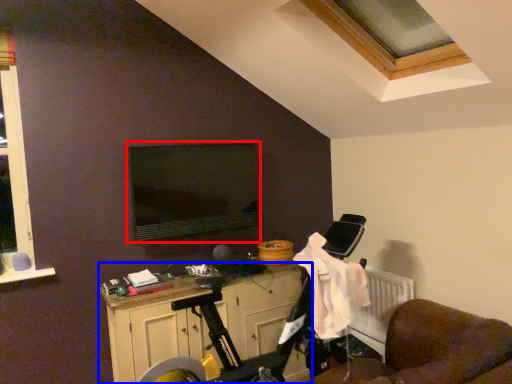
Question: Which point is closer to the camera, computer monitor (highlighted by a red box) or cabinetry (highlighted by a blue box)?

Choices:
 (A) computer monitor
 (B) cabinetry

Answer: (B)